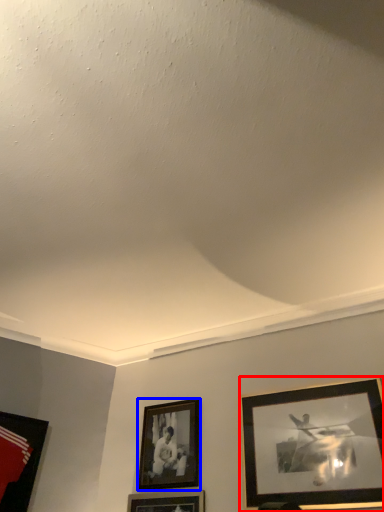
Question: Which object appears closest to the camera in this image, picture frame (highlighted by a red box) or picture frame (highlighted by a blue box)?

Choices:
 (A) picture frame
 (B) picture frame

Answer: (A)